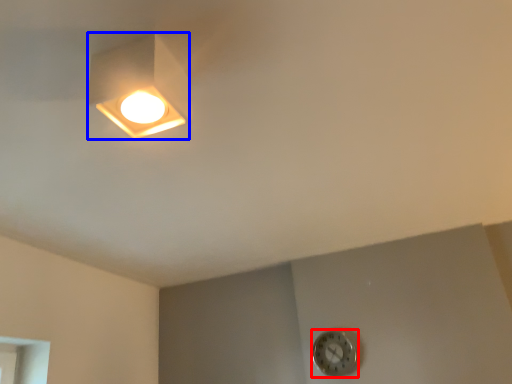
Question: Which of the following is the closest to the observer, clock (highlighted by a red box) or lamp (highlighted by a blue box)?

Choices:
 (A) clock
 (B) lamp

Answer: (B)